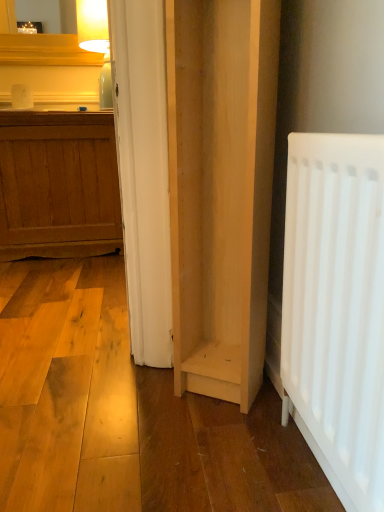
Question: Should I look upward or downward to see light wood cupboard at center?

Choices:
 (A) down
 (B) up

Answer: (B)